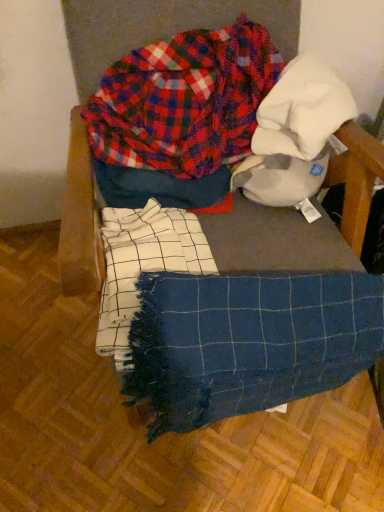
Locate an element on the screen. free spot below blue woven blanket at center (from a real-world perspective) is located at coordinates (276, 425).